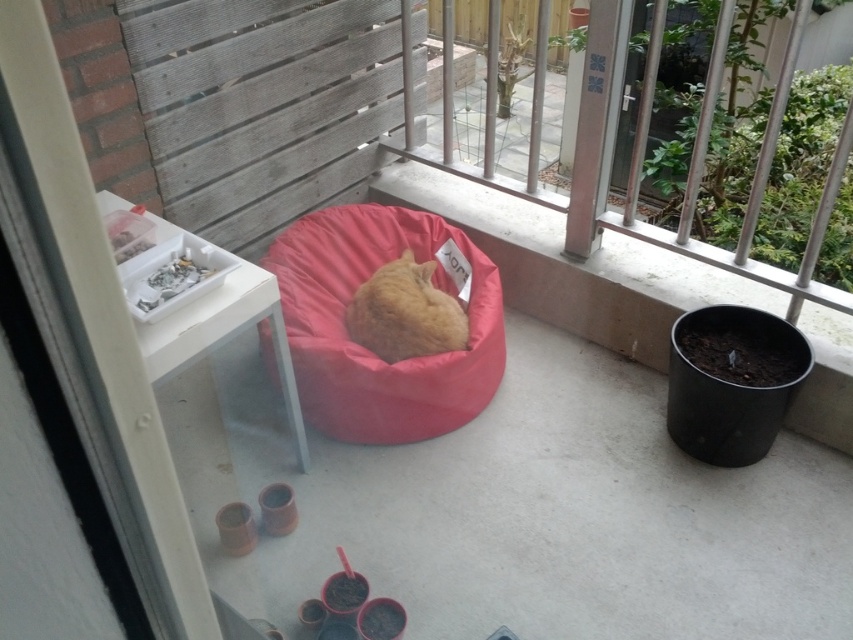
Question: Can you confirm if pink fabric bean bag at center is positioned to the left of orange soft fur cat at center?

Choices:
 (A) no
 (B) yes

Answer: (B)

Question: Is pink fabric bean bag at center below orange soft fur cat at center?

Choices:
 (A) yes
 (B) no

Answer: (A)

Question: Where is pink fabric bean bag at center located in relation to orange soft fur cat at center in the image?

Choices:
 (A) left
 (B) right

Answer: (A)

Question: Which object appears closest to the camera in this image?

Choices:
 (A) pink fabric bean bag at center
 (B) orange soft fur cat at center

Answer: (A)

Question: Which object appears farthest from the camera in this image?

Choices:
 (A) orange soft fur cat at center
 (B) pink fabric bean bag at center

Answer: (A)